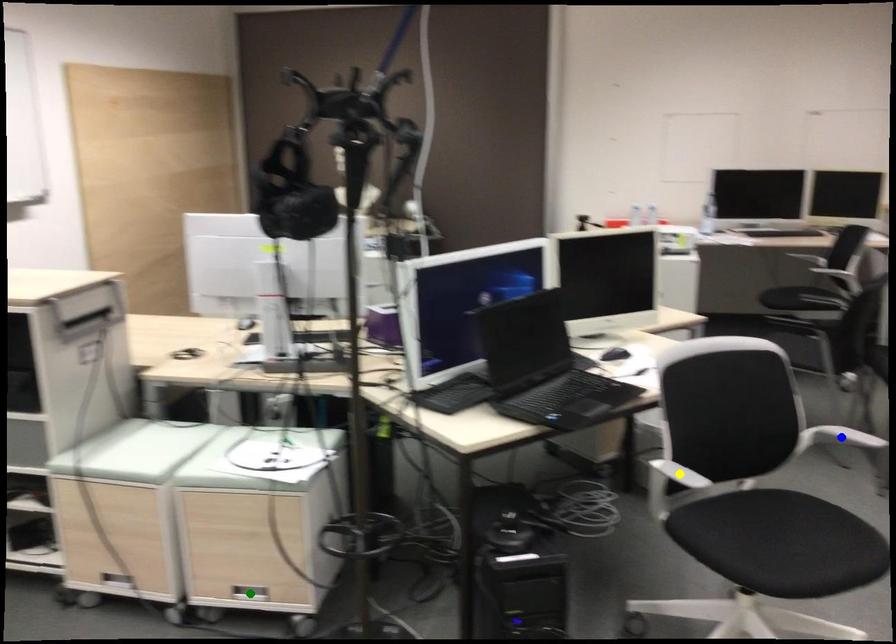
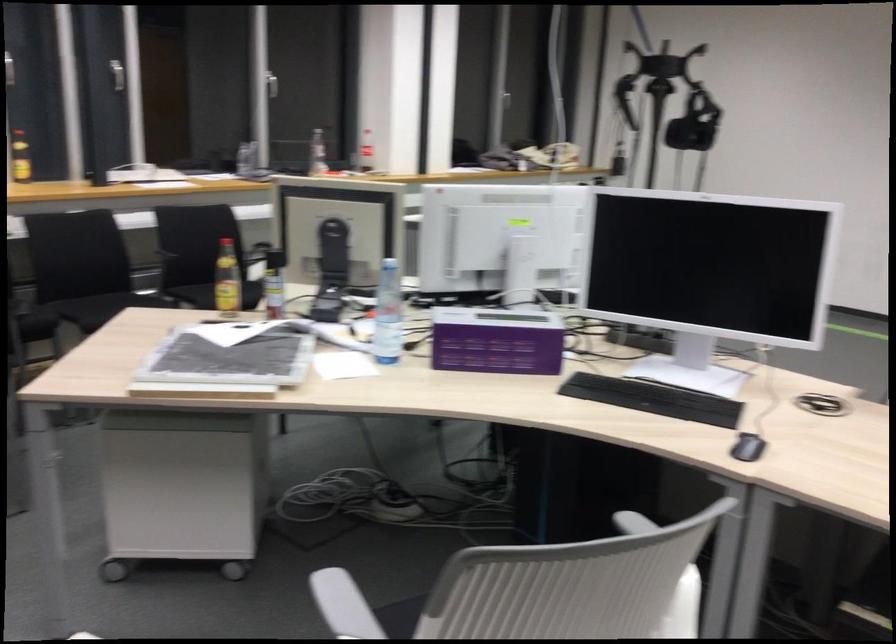
I am providing you with two images of the same scene from different viewpoints. Three points are marked in image1. Which point corresponds to a part or object that is occluded in image2?In image1, three points are marked. Which of them correspond to a part or object that is occluded in image2?Among the three points shown in image1, which one corresponds to a part or object that is no longer visible due to occlusion in image2?

blue point, green point, yellow point